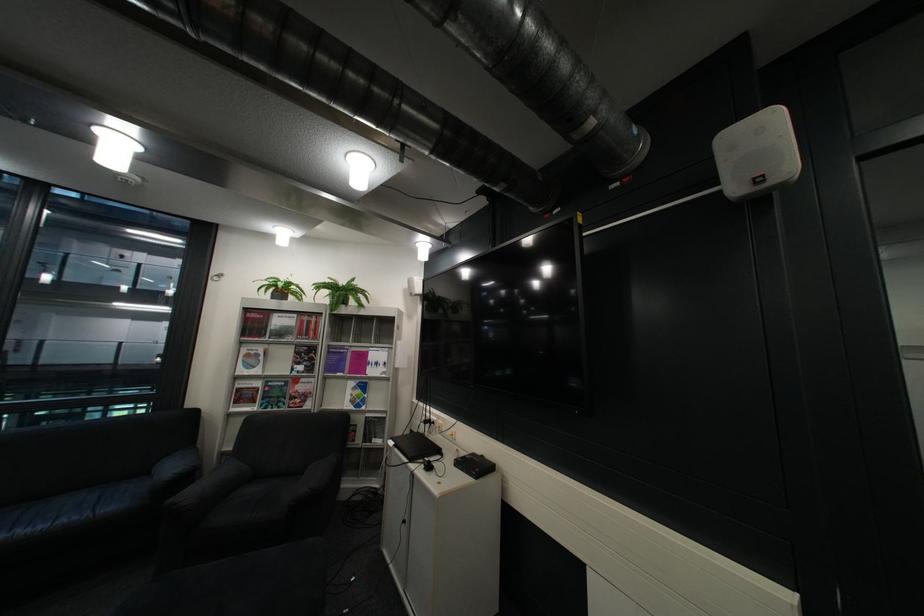
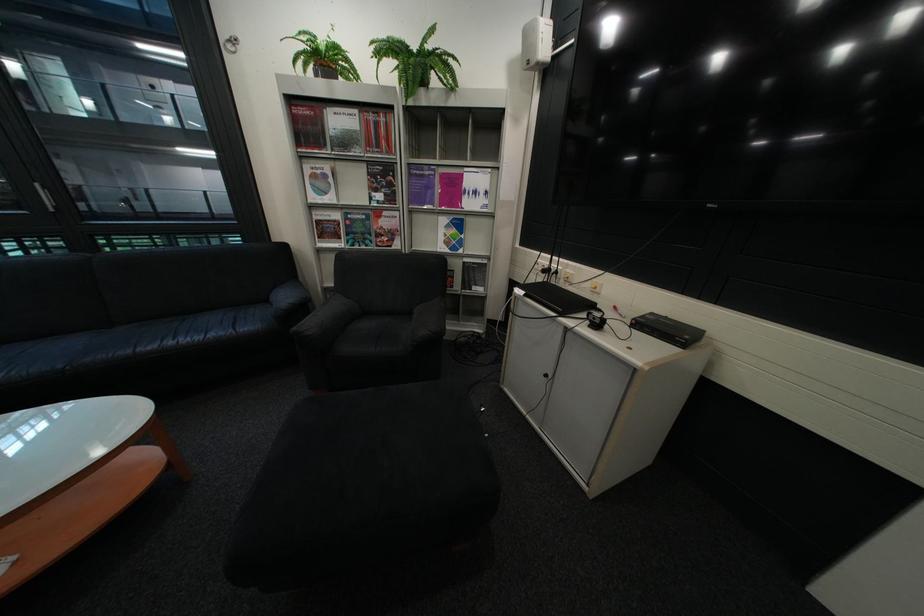
Locate, in the second image, the point that corresponds to point (262, 355) in the first image.

(329, 177)